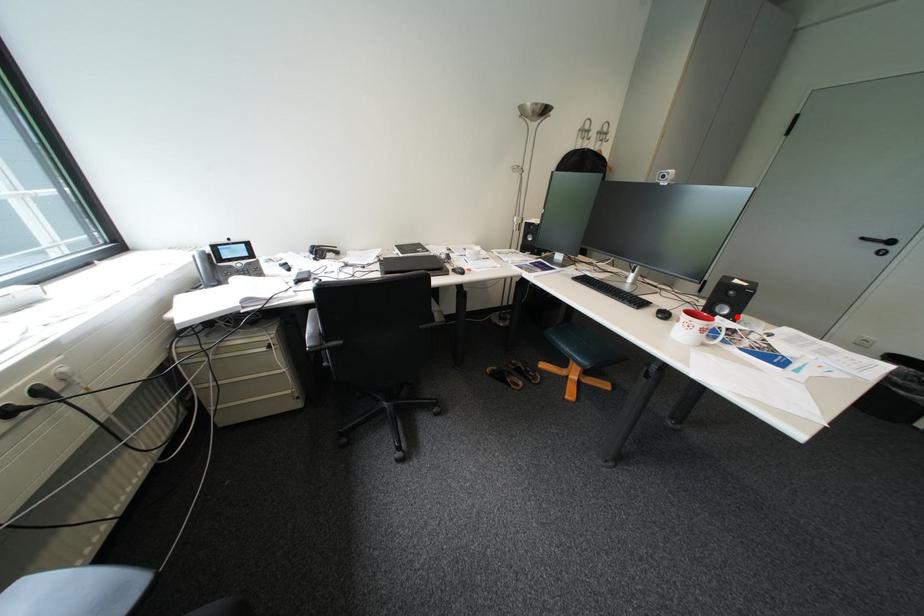
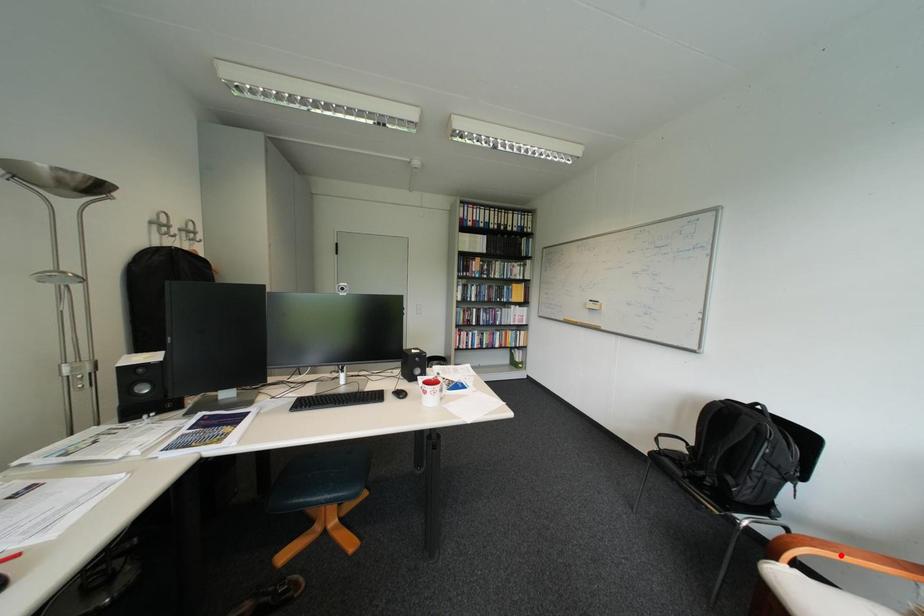
I am providing you with two images of the same scene from different viewpoints. A red point is marked on the first image and another point is marked on the second image. Are the points marked in image1 and image2 representing the same 3D position?

No